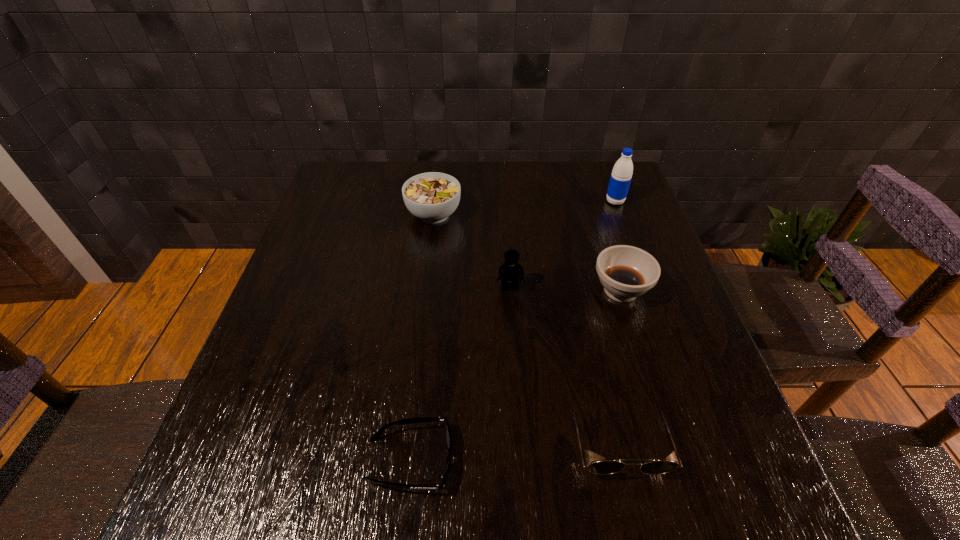
This screenshot has width=960, height=540. What are the coordinates of `free space located 0.090m on the front of the farther soup bowl` in the screenshot? It's located at (429, 254).

This screenshot has width=960, height=540. Identify the location of vacant space located on the left of the right soup bowl. (502, 291).

Identify the location of vacant space located 0.050m on the front lenses of the taller sunglasses. (634, 513).

This screenshot has width=960, height=540. What are the coordinates of `free spot located 0.070m on the front-facing side of the left sunglasses` in the screenshot? It's located at (493, 460).

Where is `water bottle present at the far edge`? Image resolution: width=960 pixels, height=540 pixels. water bottle present at the far edge is located at coordinates (621, 175).

Locate an element on the screen. The image size is (960, 540). soup bowl that is at the far edge is located at coordinates (432, 197).

Image resolution: width=960 pixels, height=540 pixels. Identify the location of water bottle positioned at the right edge. (621, 175).

This screenshot has width=960, height=540. I want to click on soup bowl at the right edge, so click(626, 272).

This screenshot has width=960, height=540. In order to click on sunglasses located in the right edge section of the desktop in this screenshot , I will do `click(655, 467)`.

Where is `object located in the far right corner section of the desktop`? Image resolution: width=960 pixels, height=540 pixels. object located in the far right corner section of the desktop is located at coordinates (621, 175).